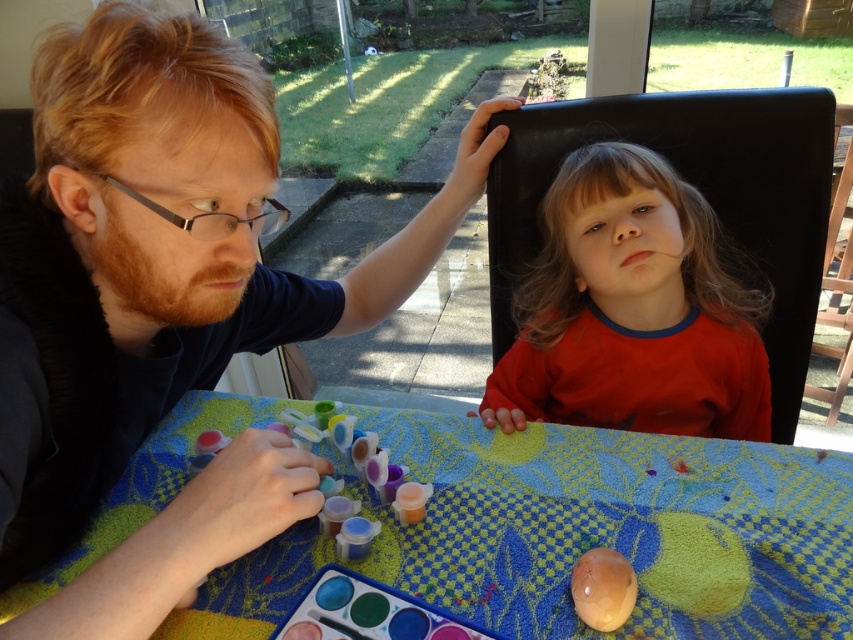
Does red matte shirt at upper center lie in front of matte brown egg at lower center?

No, it is behind matte brown egg at lower center.

Between red matte shirt at upper center and matte brown egg at lower center, which one appears on the left side from the viewer's perspective?

From the viewer's perspective, matte brown egg at lower center appears more on the left side.

Is point (747, 369) behind point (593, 625)?

Yes, point (747, 369) is behind point (593, 625).

At what (x,y) coordinates should I click in order to perform the action: click on red matte shirt at upper center. Please return your answer as a coordinate pair (x, y). Looking at the image, I should click on (631, 310).

Can you confirm if matte plastic table at center is taller than matte brown egg at lower center?

Correct, matte plastic table at center is much taller as matte brown egg at lower center.

Is matte plastic table at center in front of matte brown egg at lower center?

Yes, it is.

Is point (730, 465) closer to viewer compared to point (619, 589)?

That is False.

You are a GUI agent. You are given a task and a screenshot of the screen. Output one action in this format:
    pyautogui.click(x=<x>, y=<y>)
    Task: Click on the matte plastic table at center
    The width and height of the screenshot is (853, 640).
    Given the screenshot: What is the action you would take?
    pyautogui.click(x=577, y=534)

Between matte black shirt at upper left and matte brown egg at lower center, which one is positioned lower?

Positioned lower is matte brown egg at lower center.

Between point (195, 141) and point (598, 589), which one is positioned behind?

The point (598, 589) is behind.

At what (x,y) coordinates should I click in order to perform the action: click on matte black shirt at upper left. Please return your answer as a coordinate pair (x, y). Looking at the image, I should click on (157, 256).